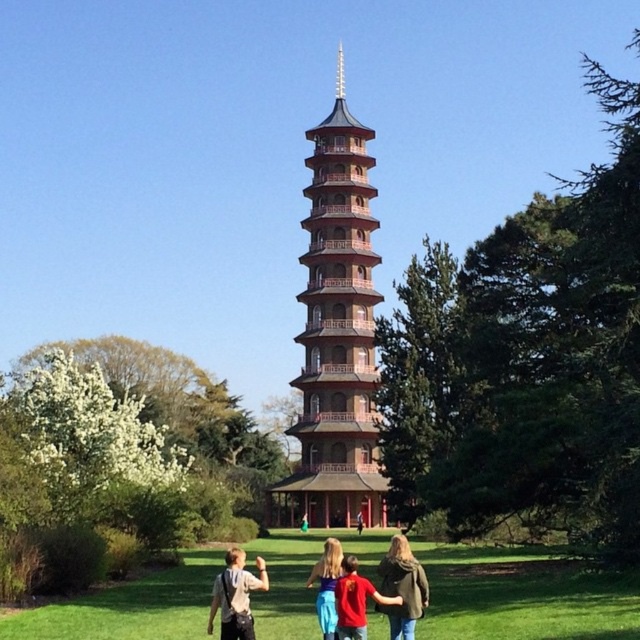
Can you confirm if green grass at lower center is positioned below green fabric dress at center?

Actually, green grass at lower center is above green fabric dress at center.

Does green grass at lower center have a greater width compared to green fabric dress at center?

Yes.

Is point (435, 580) less distant than point (307, 522)?

Yes, it is in front of point (307, 522).

Locate an element on the screen. The width and height of the screenshot is (640, 640). green grass at lower center is located at coordinates (522, 596).

Who is higher up, matte black backpack at lower center or blue denim jeans at center?

matte black backpack at lower center is above.

Consider the image. Is matte black backpack at lower center to the right of blue denim jeans at center from the viewer's perspective?

Incorrect, matte black backpack at lower center is not on the right side of blue denim jeans at center.

Which is in front, point (227, 588) or point (360, 509)?

Point (227, 588) is in front.

Identify the location of matte black backpack at lower center. This screenshot has height=640, width=640. (236, 595).

Between point (497, 634) and point (381, 572), which one is positioned behind?

The point (381, 572) is more distant.

Who is more distant from viewer, (499, 577) or (401, 536)?

Point (401, 536)

Find the location of a particular element. green grass at lower center is located at coordinates (522, 596).